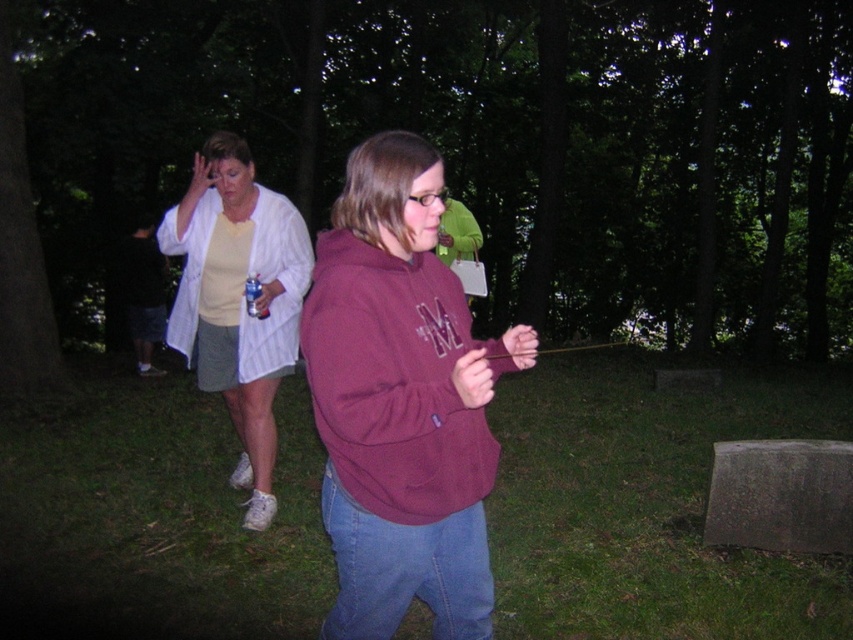
Who is more distant from viewer, (486, 604) or (138, 323)?

Positioned behind is point (138, 323).

This screenshot has height=640, width=853. What do you see at coordinates (401, 403) in the screenshot? I see `maroon hoodie at center` at bounding box center [401, 403].

This screenshot has width=853, height=640. I want to click on maroon hoodie at center, so click(401, 403).

Is light beige striped shirt at left bigger than dark gray shorts at left?

Yes.

Is light beige striped shirt at left smaller than dark gray shorts at left?

No.

Measure the distance between light beige striped shirt at left and camera.

They are 4.03 meters apart.

The image size is (853, 640). I want to click on light beige striped shirt at left, so click(238, 300).

In the scene shown: Is maroon hoodie at center in front of light beige striped shirt at left?

Yes, maroon hoodie at center is closer to the viewer.

Can you confirm if maroon hoodie at center is wider than light beige striped shirt at left?

No.

Is point (421, 442) less distant than point (270, 356)?

That is True.

Identify the location of maroon hoodie at center. (401, 403).